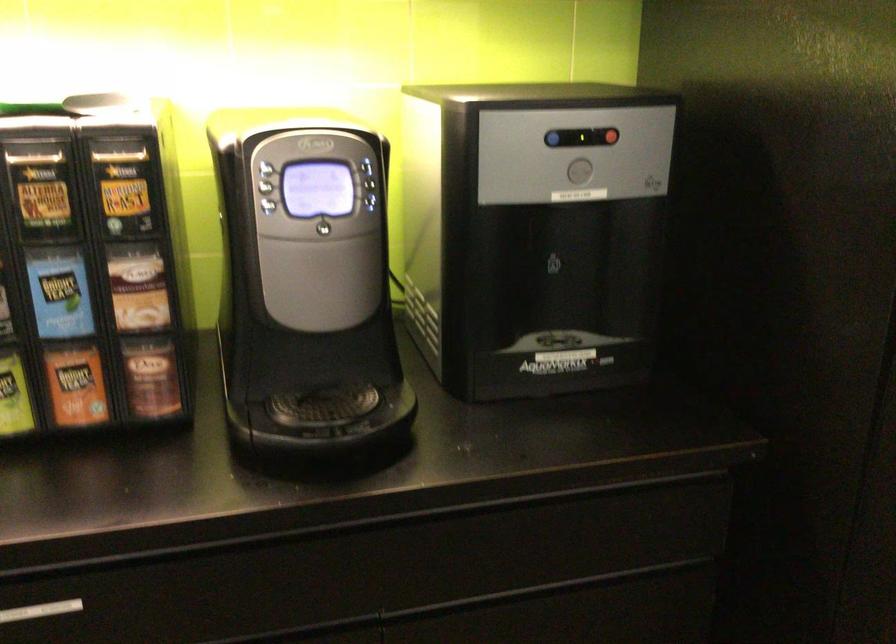
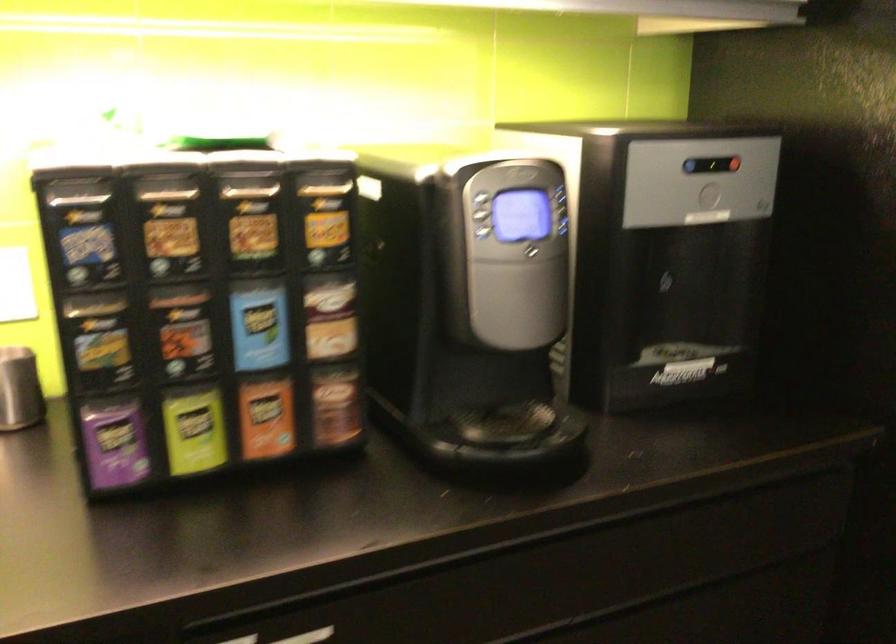
Locate, in the second image, the point that corresponds to point 368,203 in the first image.

(565, 227)